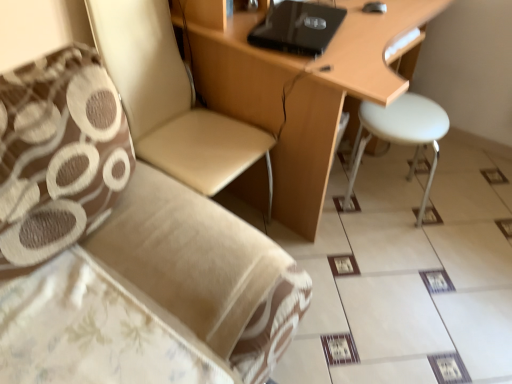
Question: Is white plastic stool at right positioned with its back to black matte laptop at upper center?

Choices:
 (A) no
 (B) yes

Answer: (A)

Question: Can you see white plastic stool at right touching black matte laptop at upper center?

Choices:
 (A) yes
 (B) no

Answer: (B)

Question: From the image's perspective, is white plastic stool at right on top of black matte laptop at upper center?

Choices:
 (A) no
 (B) yes

Answer: (A)

Question: From a real-world perspective, is white plastic stool at right located higher than black matte laptop at upper center?

Choices:
 (A) yes
 (B) no

Answer: (B)

Question: Can we say white plastic stool at right lies outside black matte laptop at upper center?

Choices:
 (A) yes
 (B) no

Answer: (A)

Question: Is brown textured pillow at left bigger or smaller than white plastic stool at right?

Choices:
 (A) big
 (B) small

Answer: (A)

Question: Which is correct: brown textured pillow at left is inside white plastic stool at right, or outside of it?

Choices:
 (A) inside
 (B) outside

Answer: (B)

Question: Is point (67, 168) positioned closer to the camera than point (430, 110)?

Choices:
 (A) closer
 (B) farther

Answer: (A)

Question: From a real-world perspective, is brown textured pillow at left above or below white plastic stool at right?

Choices:
 (A) below
 (B) above

Answer: (B)

Question: Considering the positions of beige fabric chair at upper left and white plastic stool at right in the image, is beige fabric chair at upper left wider or thinner than white plastic stool at right?

Choices:
 (A) wide
 (B) thin

Answer: (A)

Question: Is point [154, 127] positioned closer to the camera than point [417, 117]?

Choices:
 (A) closer
 (B) farther

Answer: (A)

Question: From the image's perspective, is beige fabric chair at upper left positioned above or below white plastic stool at right?

Choices:
 (A) below
 (B) above

Answer: (B)

Question: In the image, is beige fabric chair at upper left on the left side or the right side of white plastic stool at right?

Choices:
 (A) right
 (B) left

Answer: (B)

Question: Is beige fabric chair at upper left situated inside brown textured pillow at left or outside?

Choices:
 (A) outside
 (B) inside

Answer: (A)

Question: From a real-world perspective, is beige fabric chair at upper left positioned above or below brown textured pillow at left?

Choices:
 (A) below
 (B) above

Answer: (A)